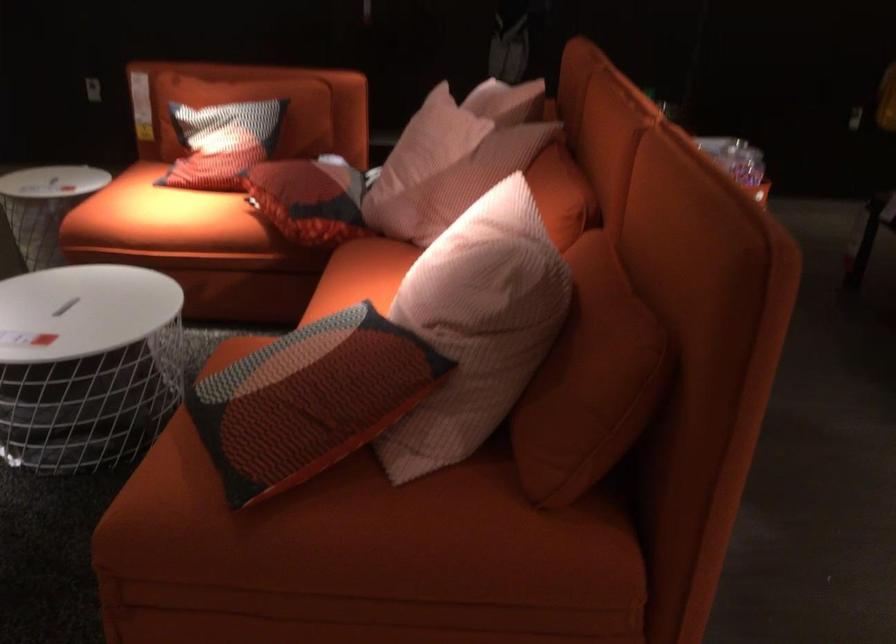
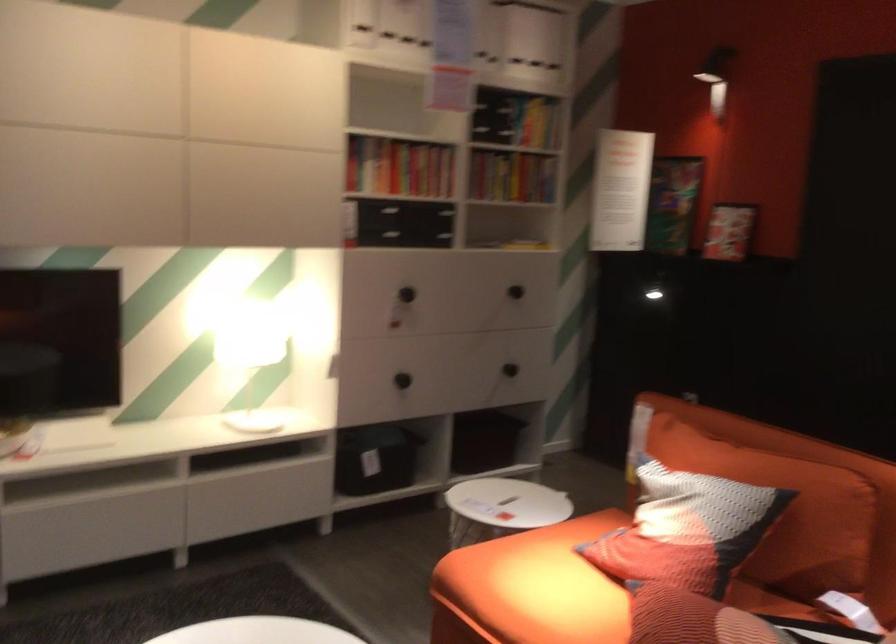
In the second image, find the point that corresponds to [293,116] in the first image.

(785, 511)